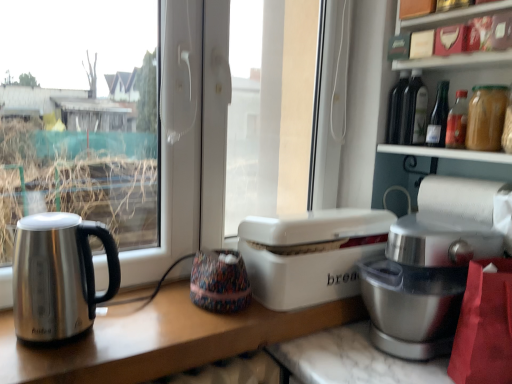
Question: Is matte glass bottles at upper right closer to camera compared to satin silver mixer at right?

Choices:
 (A) no
 (B) yes

Answer: (B)

Question: Can you confirm if matte glass bottles at upper right is positioned to the right of satin silver mixer at right?

Choices:
 (A) no
 (B) yes

Answer: (B)

Question: Is matte glass bottles at upper right aimed at satin silver mixer at right?

Choices:
 (A) no
 (B) yes

Answer: (A)

Question: Is matte glass bottles at upper right turned away from satin silver mixer at right?

Choices:
 (A) no
 (B) yes

Answer: (A)

Question: Are matte glass bottles at upper right and satin silver mixer at right far apart?

Choices:
 (A) yes
 (B) no

Answer: (B)

Question: Can you confirm if matte glass bottles at upper right is shorter than satin silver mixer at right?

Choices:
 (A) yes
 (B) no

Answer: (B)

Question: Can you confirm if white paper at right is smaller than satin silver mixer at right?

Choices:
 (A) no
 (B) yes

Answer: (B)

Question: Is white paper at right to the left of satin silver mixer at right from the viewer's perspective?

Choices:
 (A) no
 (B) yes

Answer: (A)

Question: Considering the relative sizes of white paper at right and satin silver mixer at right in the image provided, is white paper at right taller than satin silver mixer at right?

Choices:
 (A) yes
 (B) no

Answer: (B)

Question: From the image's perspective, is white paper at right below satin silver mixer at right?

Choices:
 (A) no
 (B) yes

Answer: (A)

Question: Would you say white paper at right is outside satin silver mixer at right?

Choices:
 (A) no
 (B) yes

Answer: (B)

Question: From the image's perspective, is white paper at right on top of satin silver mixer at right?

Choices:
 (A) no
 (B) yes

Answer: (B)

Question: Is satin silver mixer at right aimed at white plastic bread bin at center?

Choices:
 (A) yes
 (B) no

Answer: (B)